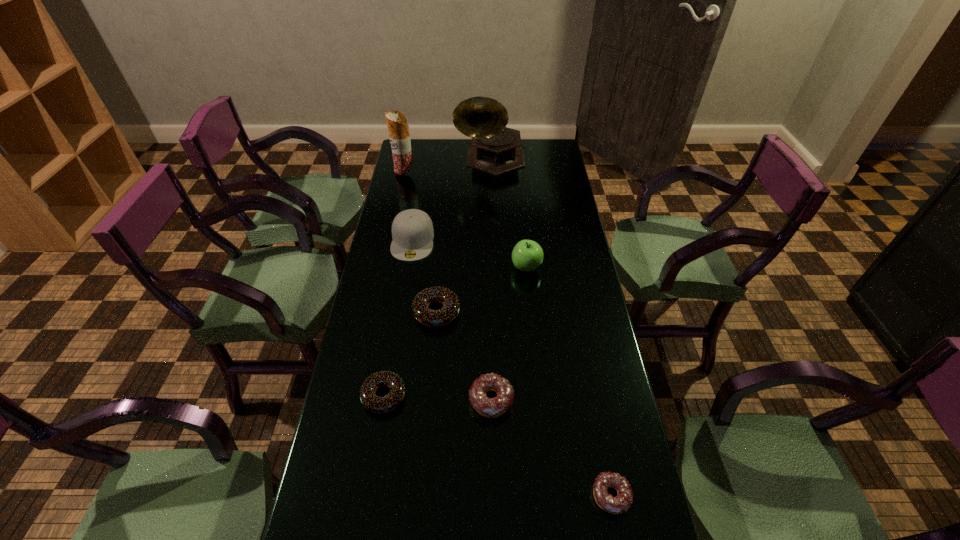
Identify the location of the fourth closest object to the burrito. The height and width of the screenshot is (540, 960). [x=432, y=318].

Identify which doughnut is the closest to the fourth nearest object. Please provide its 2D coordinates. Your answer should be formatted as a tuple, i.e. [(x, y)], where the tuple contains the x and y coordinates of a point satisfying the conditions above.

[(373, 403)]

This screenshot has height=540, width=960. I want to click on doughnut that is the third closest to the nearer chocolate doughnut, so click(x=621, y=503).

The height and width of the screenshot is (540, 960). Identify the location of chocolate doughnut that is the second closest to the right pink doughnut. (432, 318).

Where is `vacant area that satisfies the following two spatial constraints: 1. on the front-facing side of the fourth tallest object; 2. on the right side of the apple`? The width and height of the screenshot is (960, 540). vacant area that satisfies the following two spatial constraints: 1. on the front-facing side of the fourth tallest object; 2. on the right side of the apple is located at coordinates (408, 268).

In order to click on blank space that satisfies the following two spatial constraints: 1. on the front-facing side of the second doughnut from right to left; 2. on the left side of the fifth shortest object in this screenshot , I will do `click(387, 400)`.